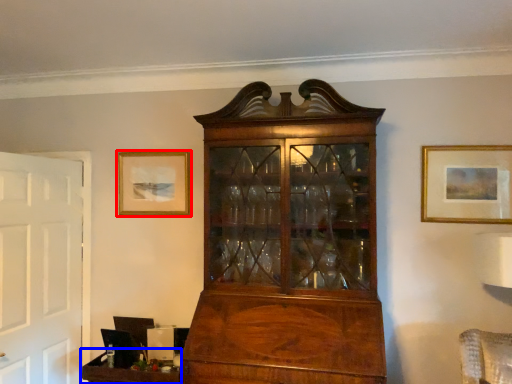
Question: Which object is closer to the camera taking this photo, picture frame (highlighted by a red box) or table (highlighted by a blue box)?

Choices:
 (A) picture frame
 (B) table

Answer: (B)